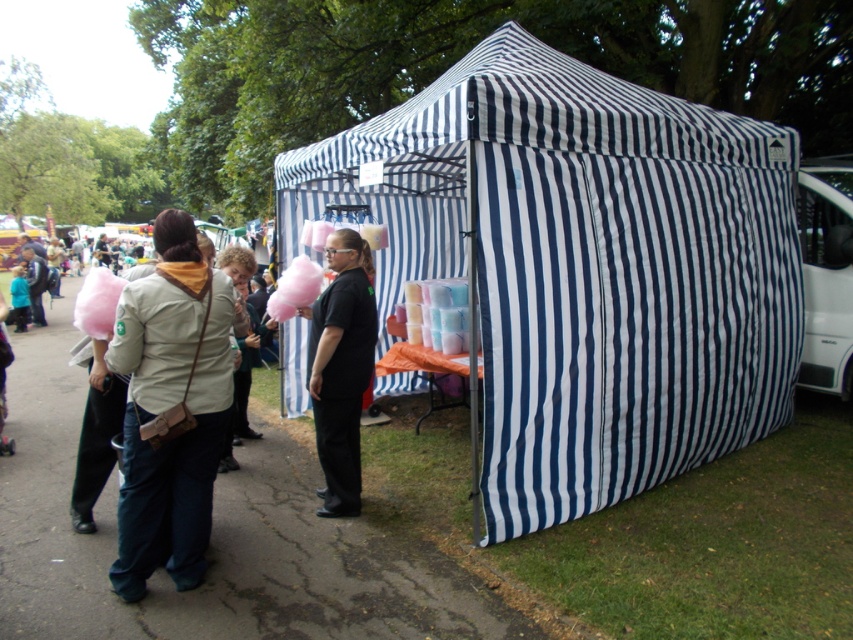
You are a customer approaching the blue and white striped tent at center and the light beige fabric jacket at center. Which object is taller?

The blue and white striped tent at center is much taller than the light beige fabric jacket at center.

You are standing at the entrance of the striped tent and want to walk to the point marked as point (323, 387). Is the point marked as point (691, 269) located behind you or in front of you relative to your direction of movement?

The point marked as point (691, 269) is behind point (323, 387), so if you walk towards point (323, 387), the point (691, 269) will be behind you relative to your direction of movement.

You are organizing a charity event and need to ensure that all participants can comfortably wear their outfits. Given that the light beige fabric jacket at center and the black matte shirt at center are both available, which one has a wider silhouette to accommodate more movement?

The light beige fabric jacket at center has a wider silhouette than the black matte shirt at center, making it more accommodating for movement.